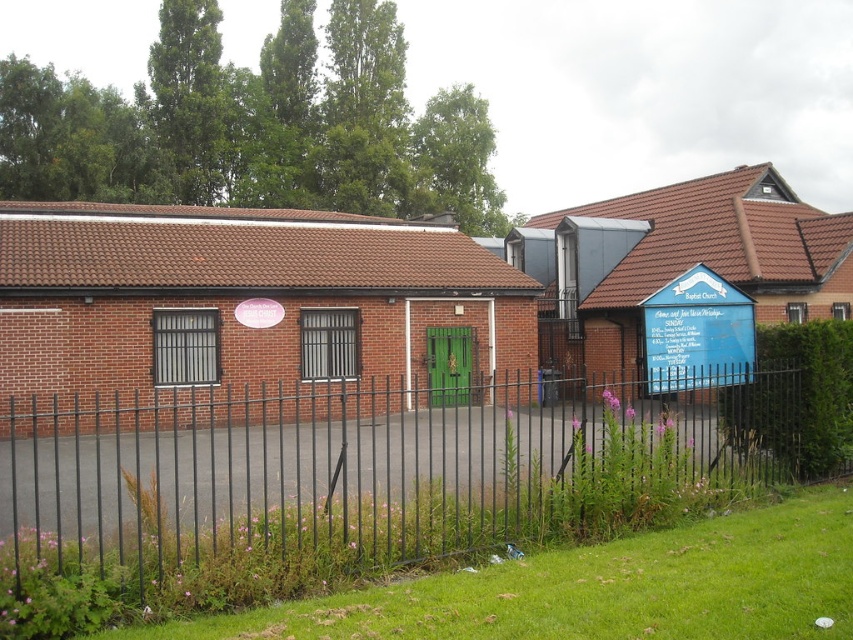
Question: Among these objects, which one is nearest to the camera?

Choices:
 (A) blue painted wooden sign at right
 (B) black metal fence at center

Answer: (B)

Question: Which object is closer to the camera taking this photo?

Choices:
 (A) blue painted wooden sign at right
 (B) black metal fence at center

Answer: (B)

Question: Can you confirm if black metal fence at center is positioned to the left of blue painted wooden sign at right?

Choices:
 (A) no
 (B) yes

Answer: (B)

Question: Can you confirm if black metal fence at center is positioned to the left of blue painted wooden sign at right?

Choices:
 (A) yes
 (B) no

Answer: (A)

Question: Does black metal fence at center have a greater width compared to blue painted wooden sign at right?

Choices:
 (A) yes
 (B) no

Answer: (A)